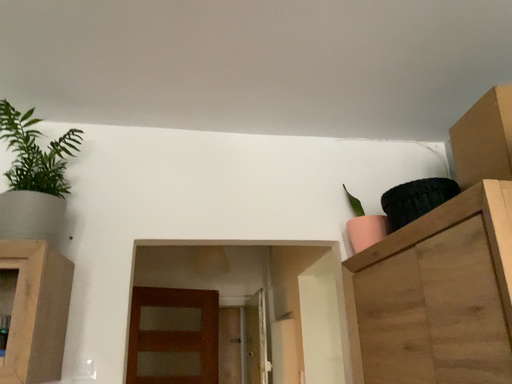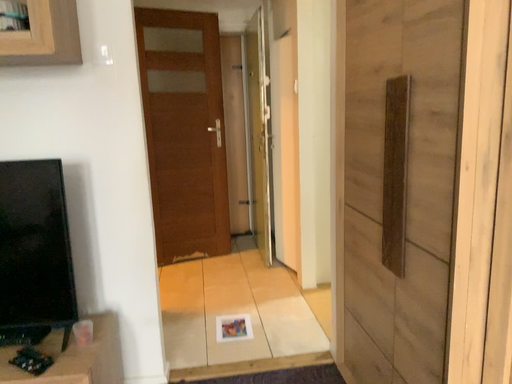
Question: Which way did the camera rotate in the video?

Choices:
 (A) rotated upward
 (B) rotated downward

Answer: (B)